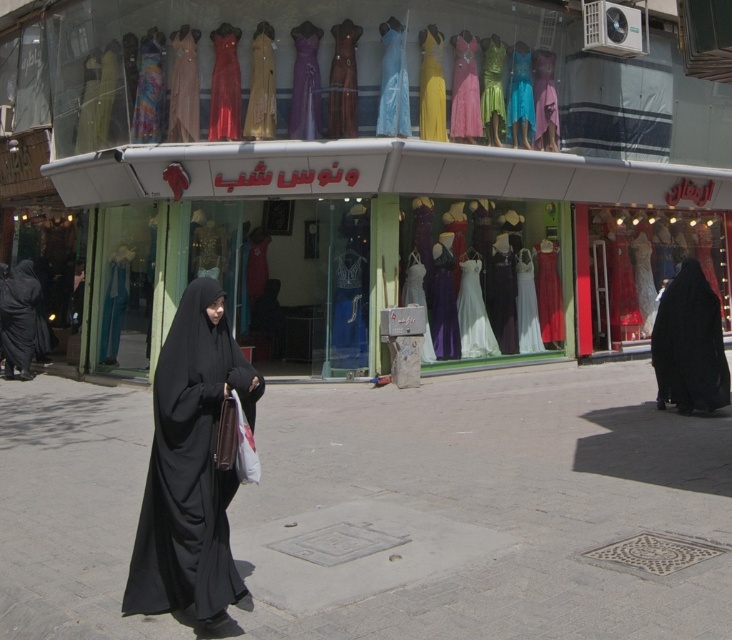
Question: Is white satin dress at center below green satin dress at center?

Choices:
 (A) no
 (B) yes

Answer: (B)

Question: Is black matte abaya at right below yellow satin dress at center?

Choices:
 (A) yes
 (B) no

Answer: (A)

Question: Which point appears farthest from the camera in this image?

Choices:
 (A) (490, 113)
 (B) (481, 307)
 (C) (714, 352)

Answer: (B)

Question: Which point is closer to the camera taking this photo?

Choices:
 (A) (474, 285)
 (B) (640, 282)
 (C) (498, 80)
 (D) (288, 316)

Answer: (C)

Question: Estimate the real-world distances between objects in this image. Which object is farther from the white satin dress at center?

Choices:
 (A) black matte abaya at center
 (B) matte glass dress at right
 (C) black matte abaya at right
 (D) green satin dress at center

Answer: (A)

Question: Does black matte abaya at center lie in front of matte blue dress at center?

Choices:
 (A) yes
 (B) no

Answer: (A)